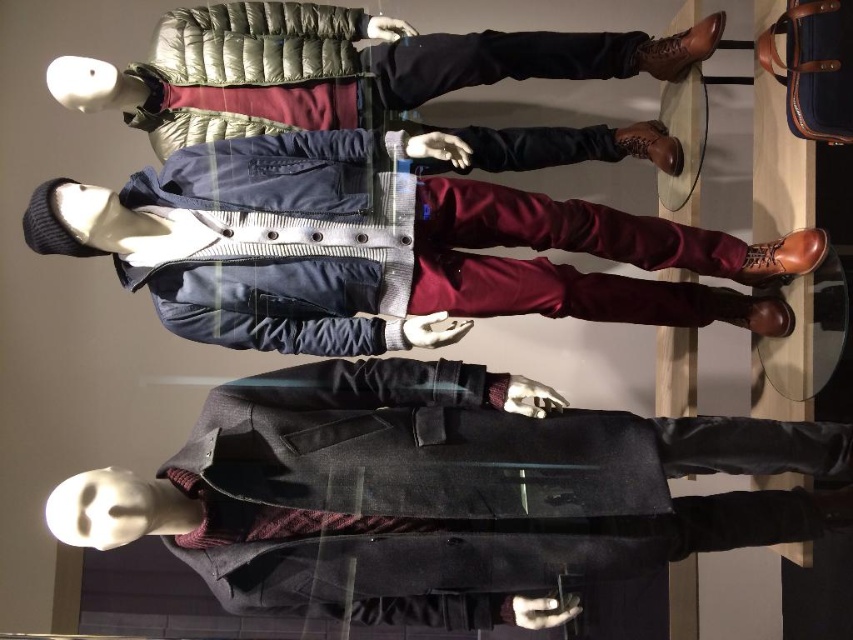
Question: Can you confirm if dark gray wool coat at center is bigger than matte blue jacket at center?

Choices:
 (A) yes
 (B) no

Answer: (A)

Question: Is dark gray wool coat at center thinner than matte blue jacket at center?

Choices:
 (A) yes
 (B) no

Answer: (A)

Question: Which point appears farthest from the camera in this image?

Choices:
 (A) (253, 196)
 (B) (338, 116)
 (C) (328, 404)

Answer: (B)

Question: Which object is positioned farthest from the matte blue jacket at center?

Choices:
 (A) dark gray wool coat at center
 (B) matte black jacket at center

Answer: (B)

Question: Which point is farther to the camera?

Choices:
 (A) dark gray wool coat at center
 (B) matte blue jacket at center

Answer: (B)

Question: Does dark gray wool coat at center have a greater width compared to matte blue jacket at center?

Choices:
 (A) no
 (B) yes

Answer: (A)